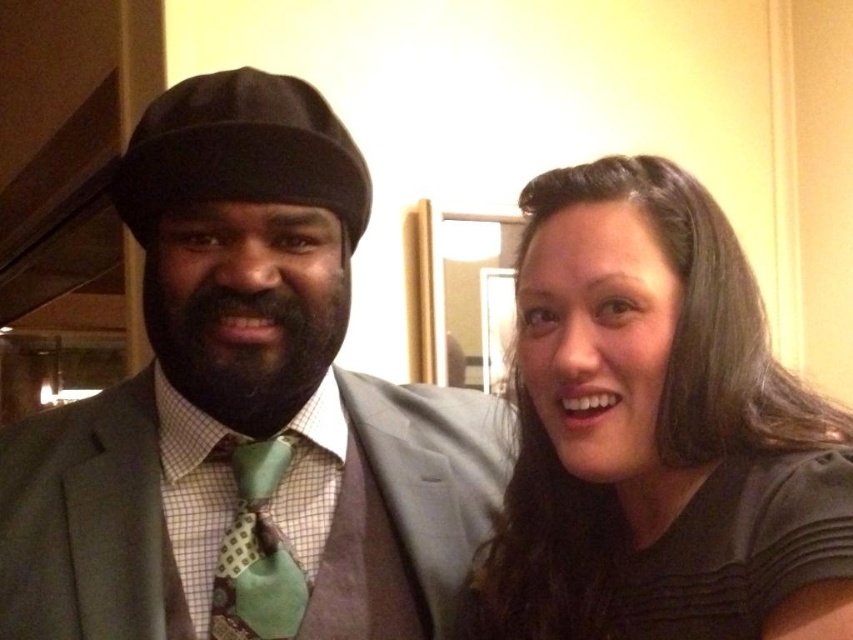
Question: Which of these objects is positioned farthest from the black matte dress at right?

Choices:
 (A) green textured tie at center
 (B) matte gray suit at center

Answer: (A)

Question: Considering the real-world distances, which object is farthest from the matte gray suit at center?

Choices:
 (A) black matte dress at right
 (B) black fuzzy beard at center

Answer: (A)

Question: Observing the image, what is the correct spatial positioning of black matte hair at upper right in reference to black fuzzy beard at center?

Choices:
 (A) above
 (B) below

Answer: (B)

Question: Which of the following is the farthest from the observer?

Choices:
 (A) (187, 376)
 (B) (276, 376)
 (C) (233, 595)
 (D) (767, 467)

Answer: (C)

Question: Can you confirm if matte gray suit at center is smaller than green textured tie at center?

Choices:
 (A) no
 (B) yes

Answer: (A)

Question: Is black fuzzy beard at center in front of green textured tie at center?

Choices:
 (A) yes
 (B) no

Answer: (A)